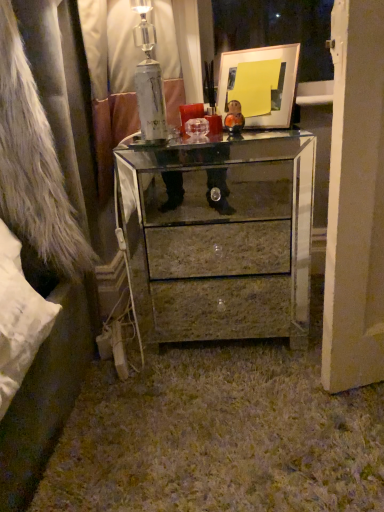
Where is `free space in front of matte gold picture frame at upper center`? This screenshot has width=384, height=512. free space in front of matte gold picture frame at upper center is located at coordinates (246, 135).